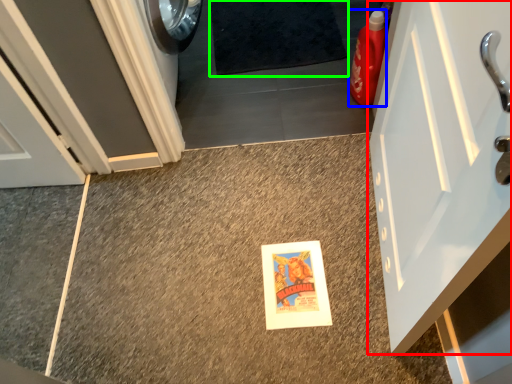
Question: Which object is the farthest from door (highlighted by a red box)? Choose among these: cleaning product (highlighted by a blue box) or bath mat (highlighted by a green box).

Choices:
 (A) cleaning product
 (B) bath mat

Answer: (B)